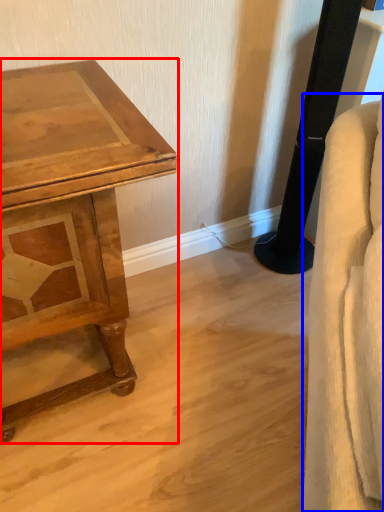
Question: Which object is closer to the camera taking this photo, table (highlighted by a red box) or swivel chair (highlighted by a blue box)?

Choices:
 (A) table
 (B) swivel chair

Answer: (B)